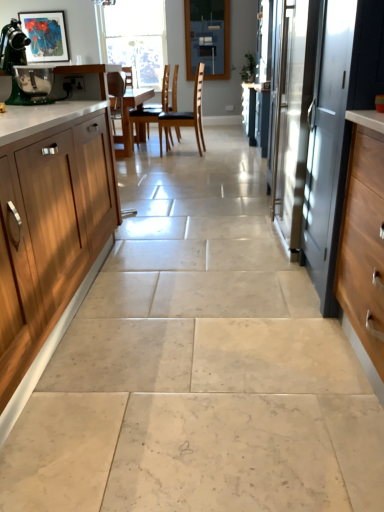
Locate an element on the screen. free space in front of satin silver screen door at right is located at coordinates (263, 276).